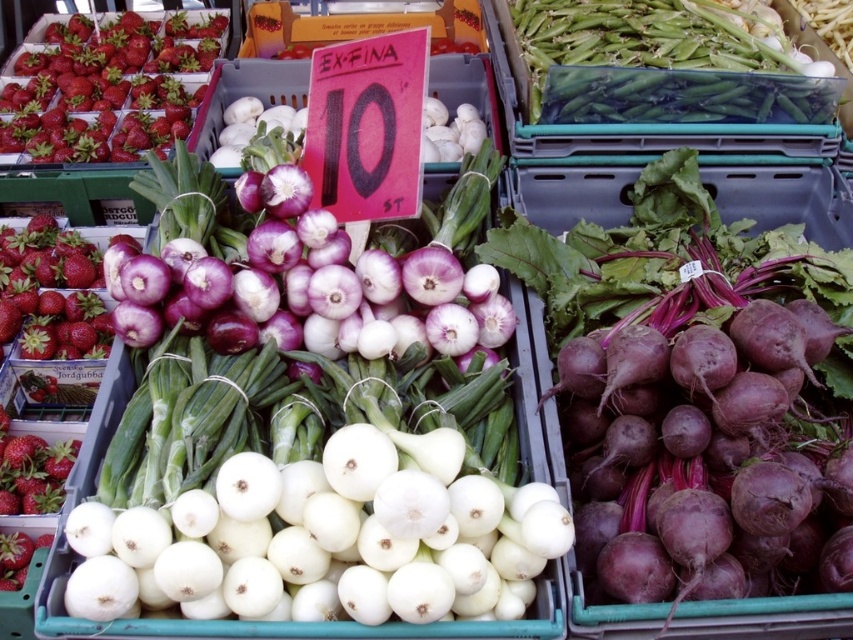
You are a vendor at the market and need to determine which item takes up more horizontal space for packaging purposes. Which object is wider between the purple matte beetroot at right and the green smooth skin at upper center?

The purple matte beetroot at right might be wider than green smooth skin at upper center according to the description.